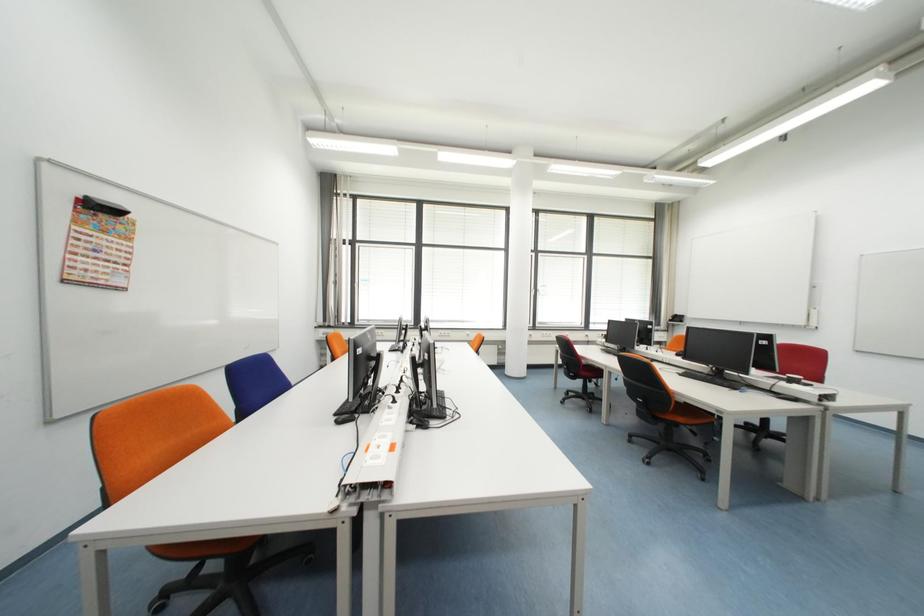
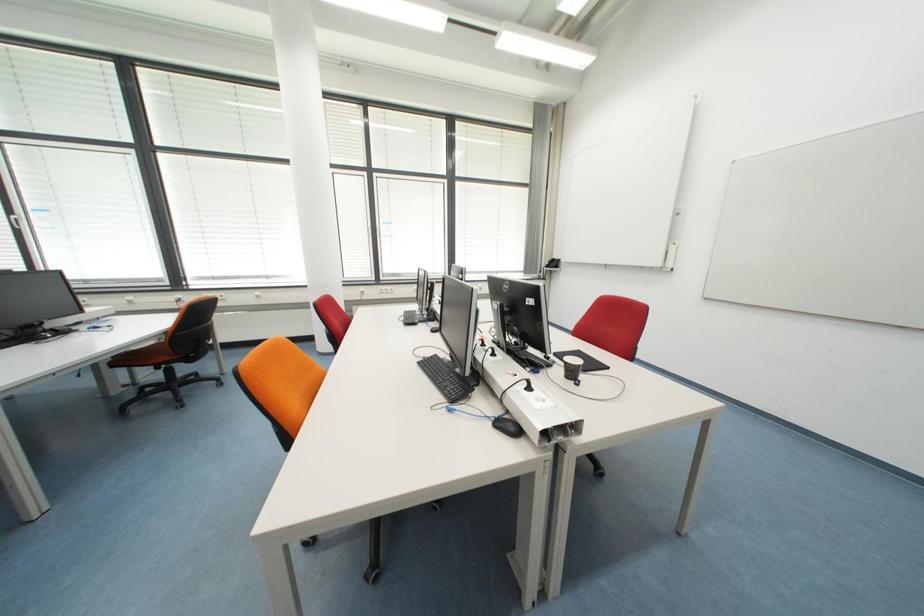
What movement of the cameraman would produce the second image?

The cameraman walked toward right, forward.